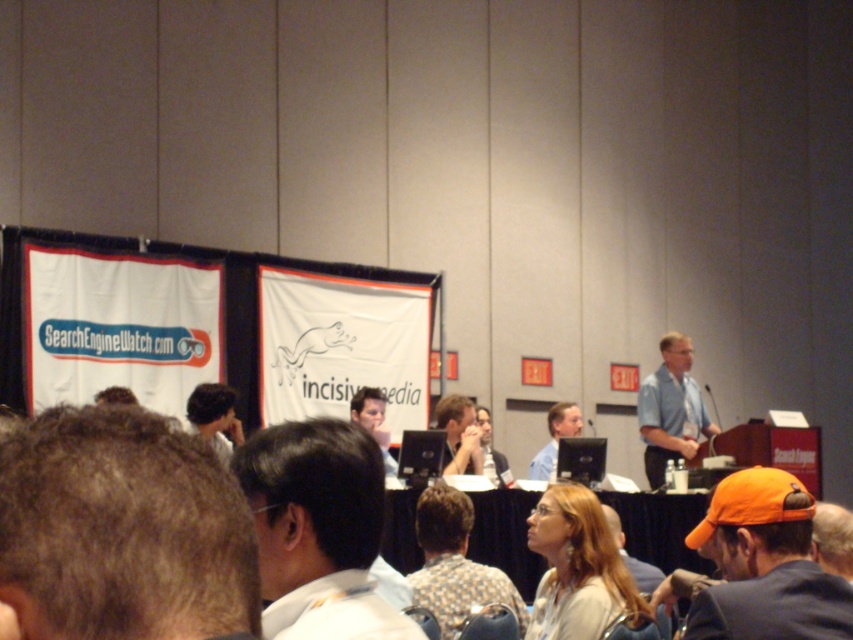
You are an attendee at the conference and need to identify the speaker based on their clothing. You notice two individuals in the front row wearing a matte white blouse at center and a floral shirt at center. Which one is more likely to be the speaker?

The speaker is positioned on the right side of the image, so the individual wearing the matte white blouse at center is more likely to be the speaker since they are on the right side compared to the floral shirt at center.

You are attending a conference and notice two features of the speaker in the image. The first is a matte white blouse at center and the second is dark brown hair at center. Which feature is positioned lower on the speaker?

The matte white blouse at center is located below dark brown hair at center, so the matte white blouse at center is positioned lower on the speaker.

You are an attendee at the conference and want to take a photo of the speaker. The speaker is standing at the podium on the right side of the stage. There is a point marked at coordinates (122,531) in the image. What does this point correspond to?

The point at coordinates (122,531) corresponds to the brown hair at lower left of the speaker.